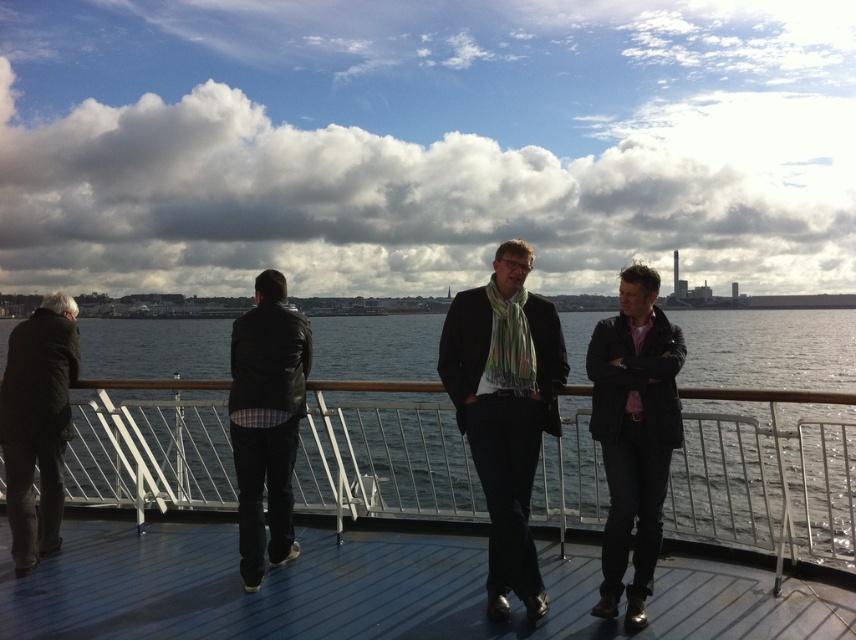
Question: Which point is farther to the camera?

Choices:
 (A) dark gray wool coat at left
 (B) matte black jacket at center
 (C) smooth wooden deck at center
 (D) blue water at center

Answer: (A)

Question: Which object is farther from the camera taking this photo?

Choices:
 (A) blue water at center
 (B) dark gray wool coat at left

Answer: (B)

Question: Can you confirm if matte black jacket at center is smaller than matte black jacket at right?

Choices:
 (A) no
 (B) yes

Answer: (A)

Question: Does leather jacket at center appear on the left side of dark gray wool coat at left?

Choices:
 (A) yes
 (B) no

Answer: (B)

Question: Is matte black jacket at center bigger than leather jacket at center?

Choices:
 (A) no
 (B) yes

Answer: (A)

Question: Which of the following is the farthest from the observer?

Choices:
 (A) dark gray wool coat at left
 (B) matte black jacket at right
 (C) matte black jacket at center

Answer: (A)